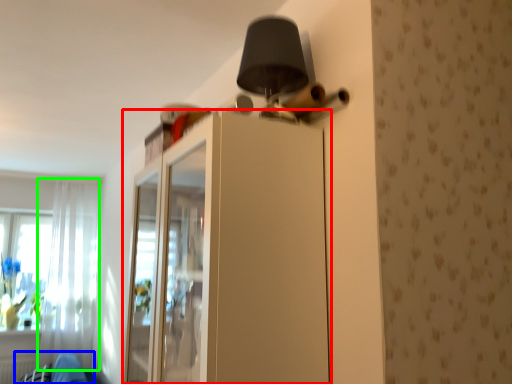
Question: Which object is positioned closest to dresser (highlighted by a red box)? Select from swivel chair (highlighted by a blue box) and curtain (highlighted by a green box).

Choices:
 (A) swivel chair
 (B) curtain

Answer: (A)